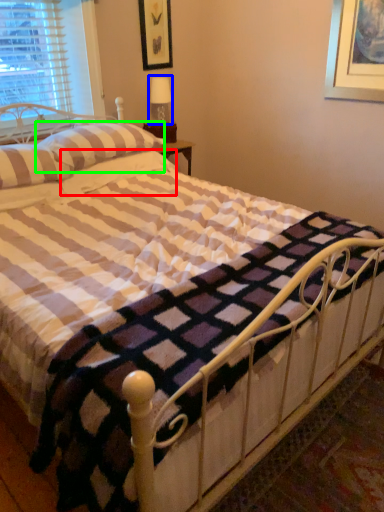
Question: Which is farther away from pillow (highlighted by a red box)? table lamp (highlighted by a blue box) or pillow (highlighted by a green box)?

Choices:
 (A) table lamp
 (B) pillow

Answer: (A)